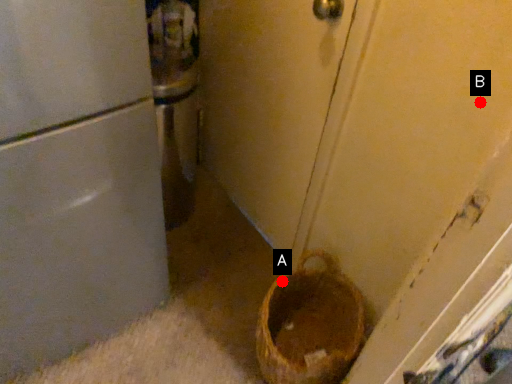
Question: Two points are circled on the image, labeled by A and B beside each circle. Among these points, which one is nearest to the camera?

Choices:
 (A) A is closer
 (B) B is closer

Answer: (B)